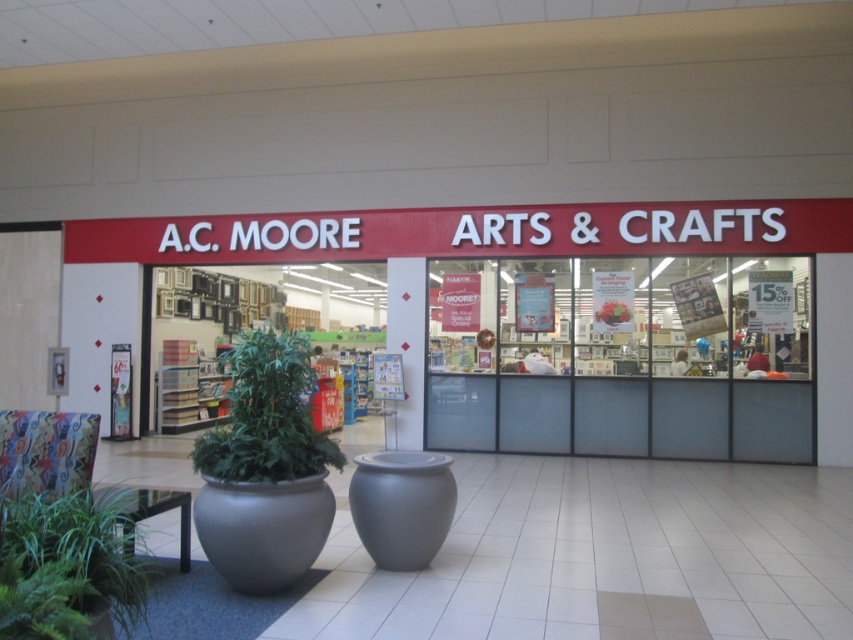
You are standing at the entrance of the A.C. Moore Arts and Crafts store. You want to place a new promotional sign at point [67,566]. What object is already located there?

At point [67,566] lies green leafy plant at lower left.

From the picture: You are standing at the entrance of the A.C. MOORE ARTS store and want to place a new decorative item between the matte red sign at center and the green leafy plant at lower left. The item is 25 feet long. Will it fit between them?

The distance between the matte red sign at center and the green leafy plan at lower left is 24.92 feet. Since the item is 25 feet long, it will not fit between them as it is slightly longer than the available space.

You are standing in the mall and looking at the A.C. MOORE store entrance. You notice a matte red sign at center and a green leafy plant at center. Which object is closer to you?

The matte red sign at center is closer to you because it is further to the viewer than the green leafy plant at center.